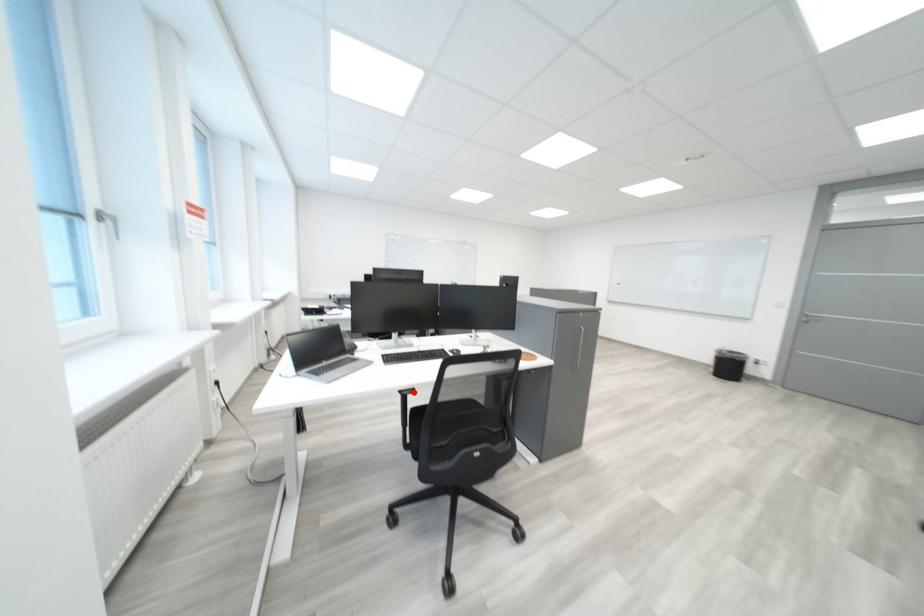
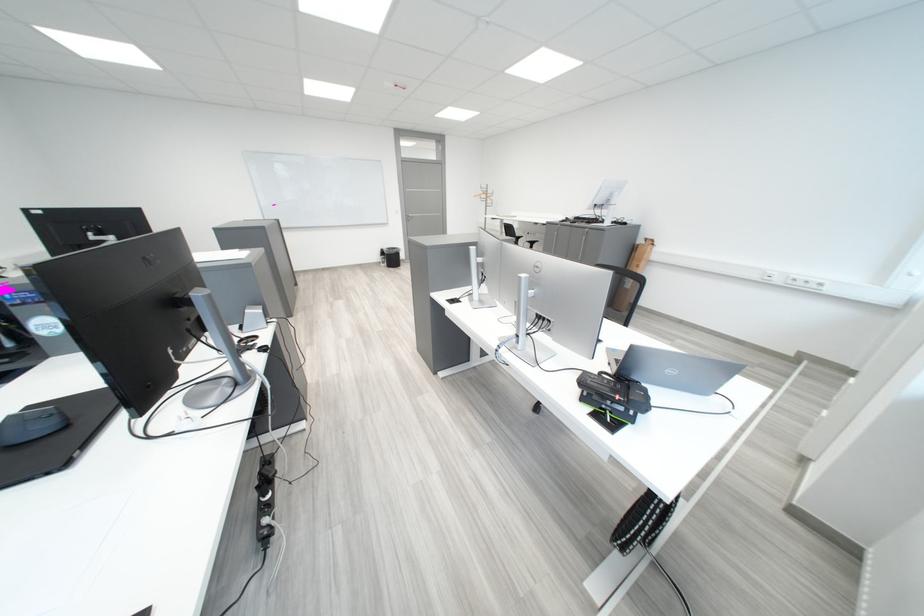
Question: I am providing you with two images of the same scene from different viewpoints. A red point is marked on the first image. At the location where the point appears in image 1, is it still visible in image 2?

Choices:
 (A) Yes
 (B) No

Answer: (B)